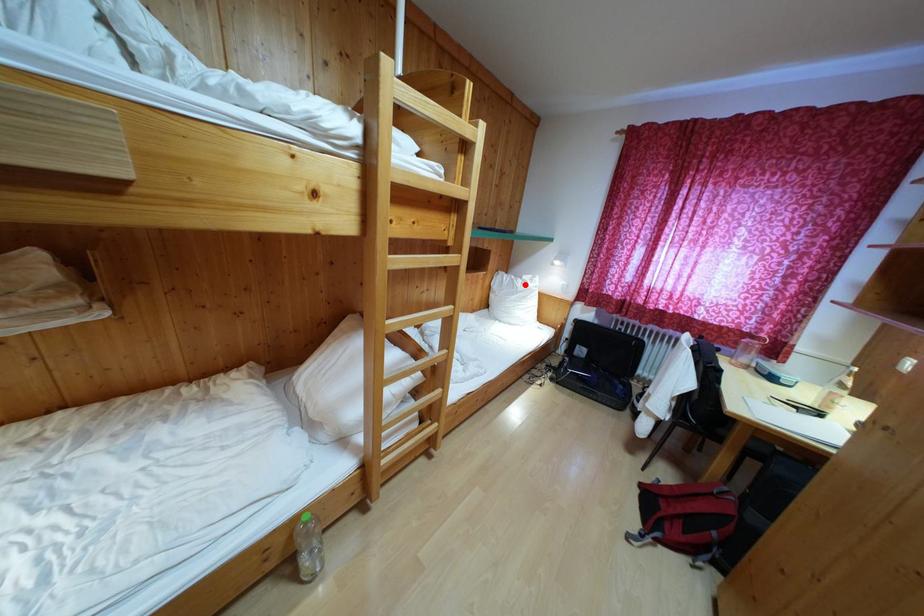
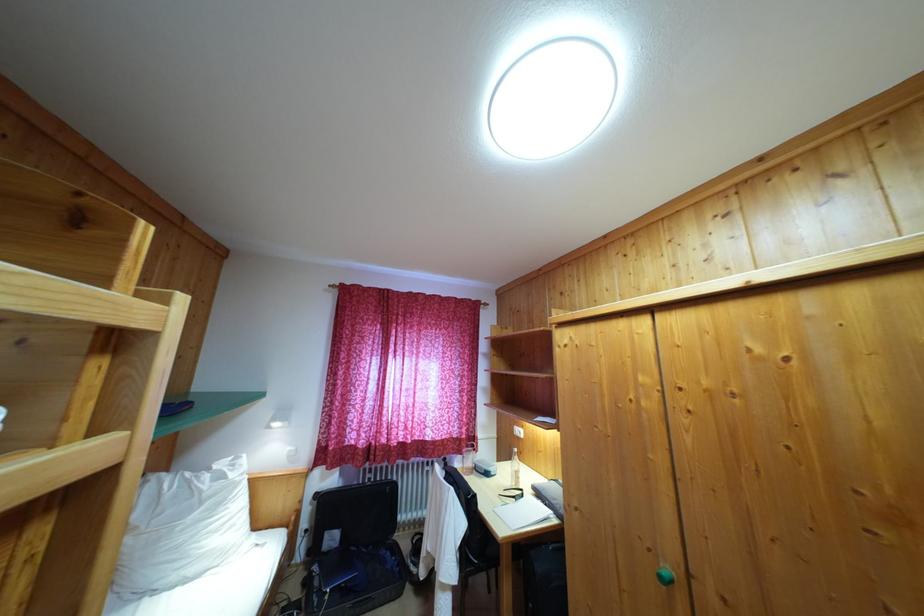
Find the pixel in the second image that matches the highlighted location in the first image.

(213, 476)